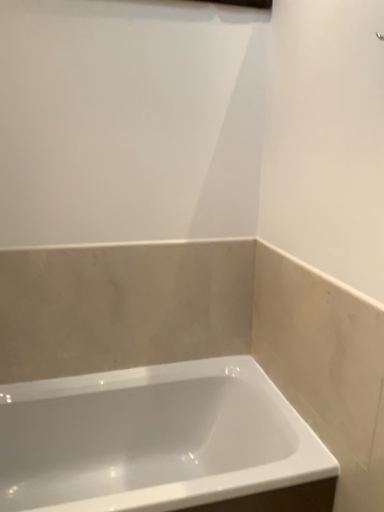
Question: Should I look upward or downward to see white glossy bathtub at center?

Choices:
 (A) down
 (B) up

Answer: (A)